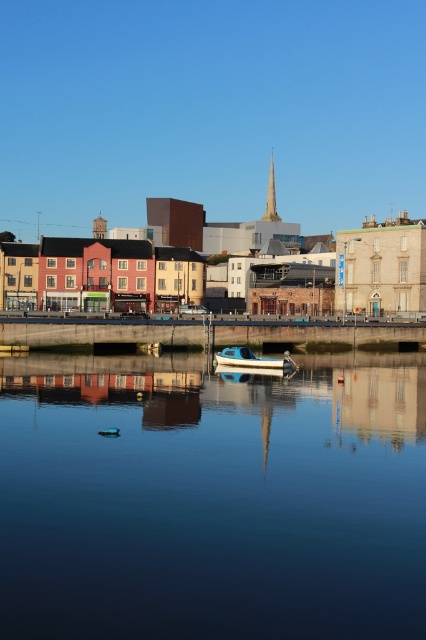
You are a photographer planning to capture the reflection of the concrete dock at center and the white plastic boat at center in the calm water. Which object will have a larger reflection in the water?

The concrete dock at center is larger in size than the white plastic boat at center, so its reflection in the water will also be larger.

Based on the photo, you are standing on the concrete dock at center and want to see the smooth glass water at center. In which direction should you look?

You should look to the left because the smooth glass water at center is to the left of the concrete dock at center.